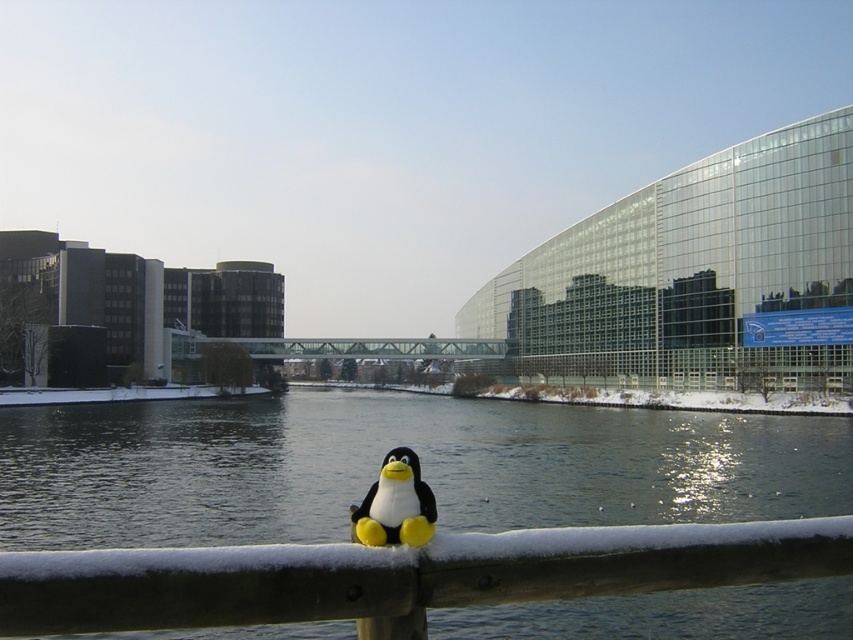
Which of these two, clear water at railing center or matte plush penguin at center, stands shorter?

matte plush penguin at center is shorter.

Is clear water at railing center wider than matte plush penguin at center?

Yes.

This screenshot has height=640, width=853. Describe the element at coordinates (380, 461) in the screenshot. I see `clear water at railing center` at that location.

Identify the location of clear water at railing center. Image resolution: width=853 pixels, height=640 pixels. (380, 461).

Image resolution: width=853 pixels, height=640 pixels. Describe the element at coordinates (380, 461) in the screenshot. I see `clear water at railing center` at that location.

Is point (194, 403) more distant than point (503, 582)?

Yes.

The width and height of the screenshot is (853, 640). I want to click on clear water at railing center, so click(380, 461).

Is point (608, 548) farther from camera compared to point (390, 477)?

Yes, it is behind point (390, 477).

Is snow-covered wooden rail at center to the right of matte plush penguin at center from the viewer's perspective?

Correct, you'll find snow-covered wooden rail at center to the right of matte plush penguin at center.

This screenshot has width=853, height=640. Identify the location of snow-covered wooden rail at center. (399, 573).